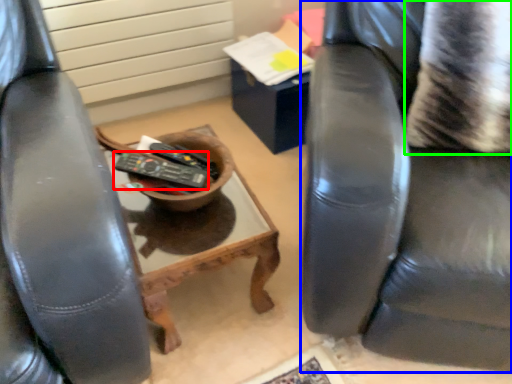
Question: Considering the real-world distances, which object is closest to remote control (highlighted by a red box)? chair (highlighted by a blue box) or pillow (highlighted by a green box).

Choices:
 (A) chair
 (B) pillow

Answer: (A)